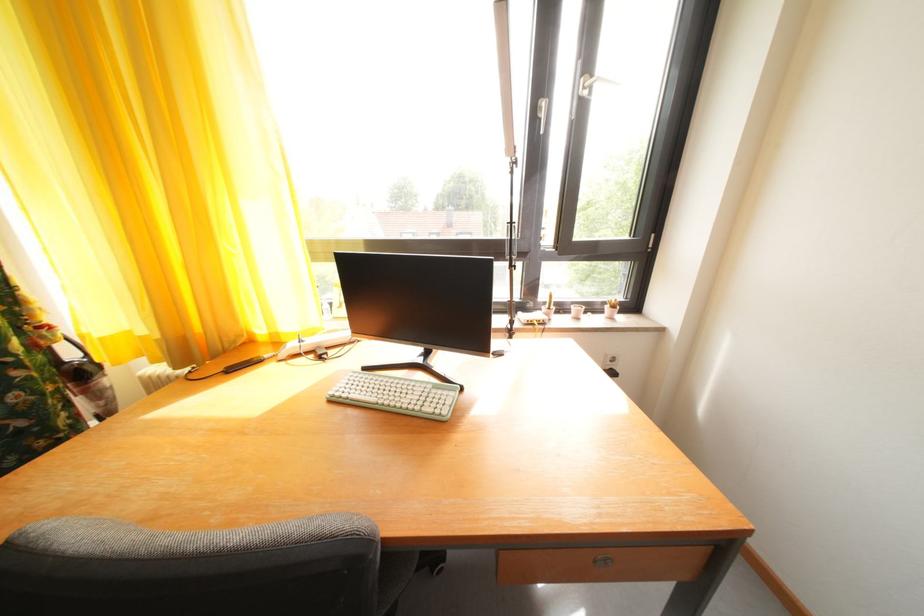
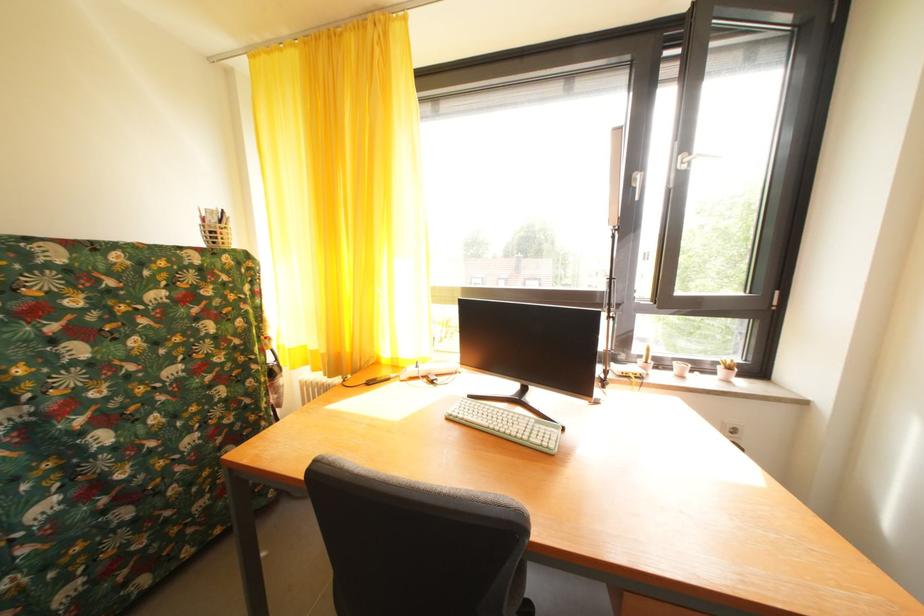
The point at (x=590, y=82) is marked in the first image. Where is the corresponding point in the second image?

(689, 159)